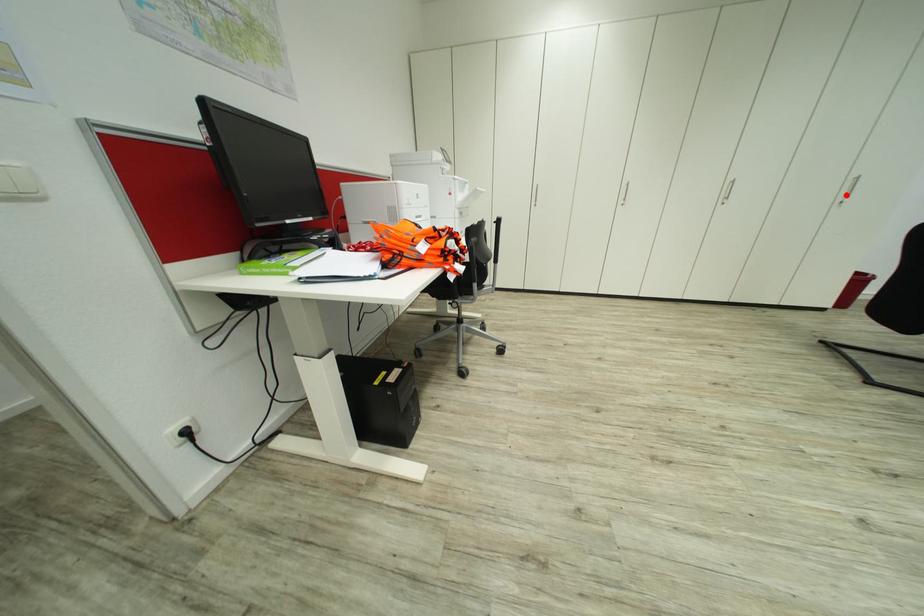
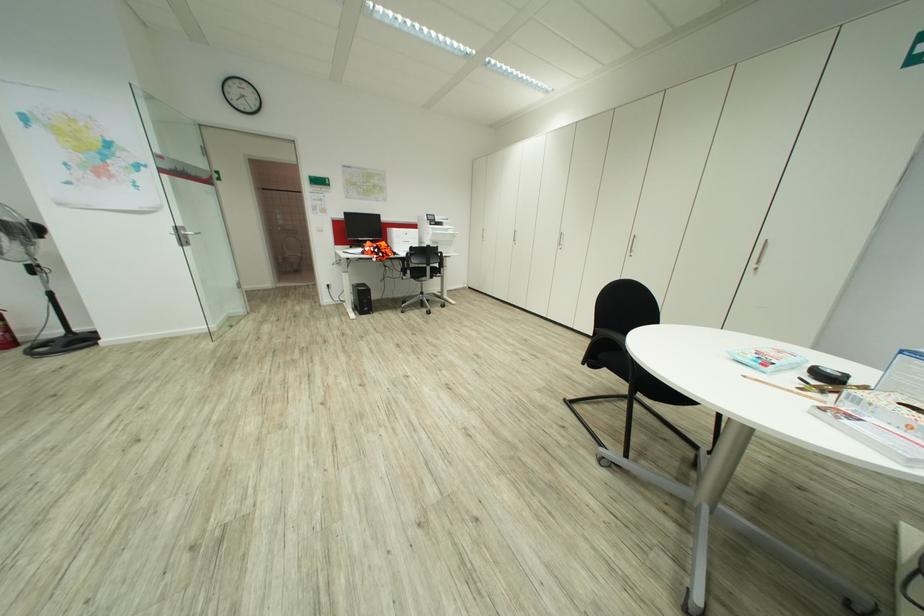
Question: I am providing you with two images of the same scene from different viewpoints. A red point is shown in image1. For the corresponding object point in image2, is it positioned nearer or farther from the camera?

Choices:
 (A) Nearer
 (B) Farther

Answer: (A)